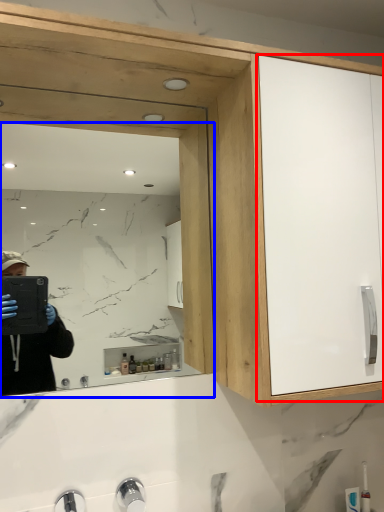
Question: Which point is further to the camera, glass door (highlighted by a red box) or mirror (highlighted by a blue box)?

Choices:
 (A) glass door
 (B) mirror

Answer: (B)